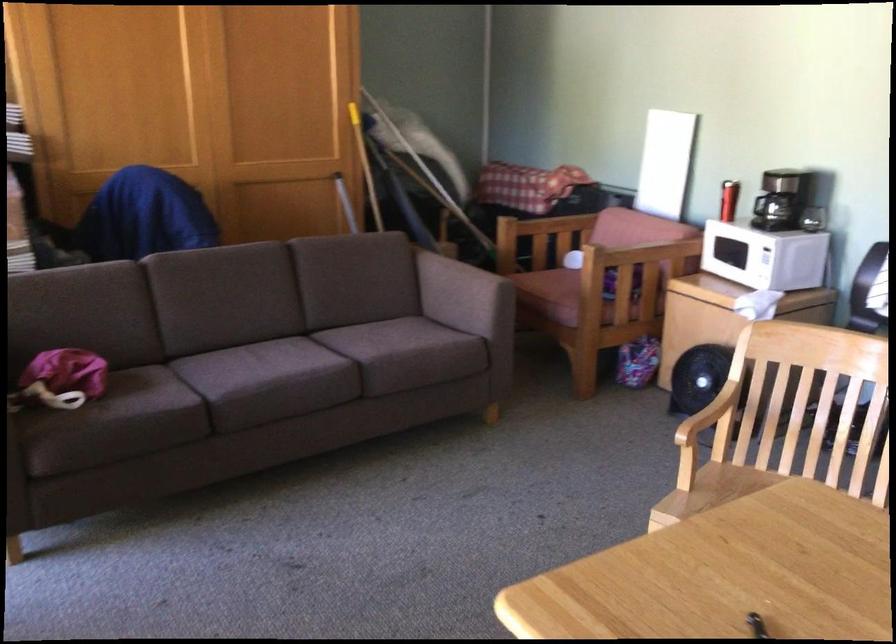
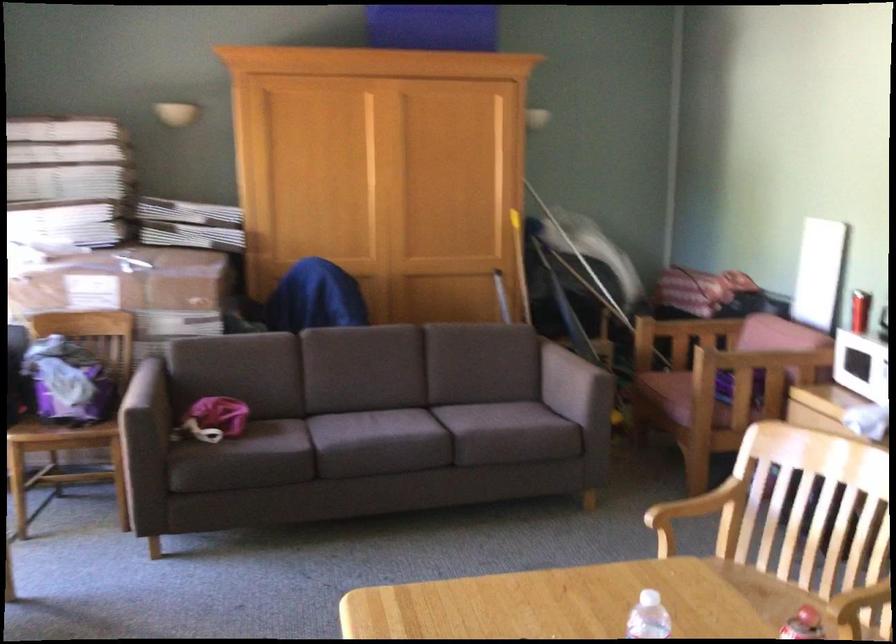
The point at (472, 299) is marked in the first image. Where is the corresponding point in the second image?

(574, 386)